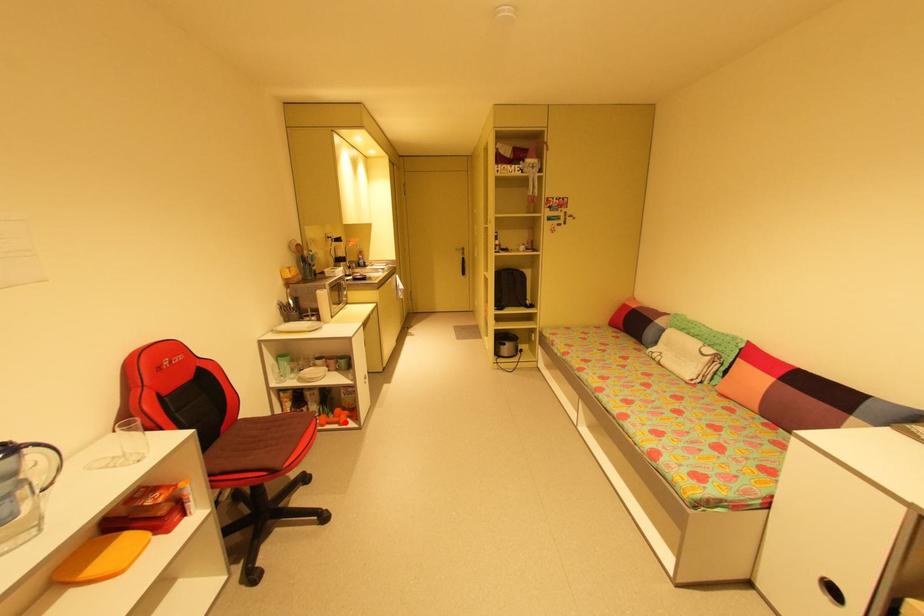
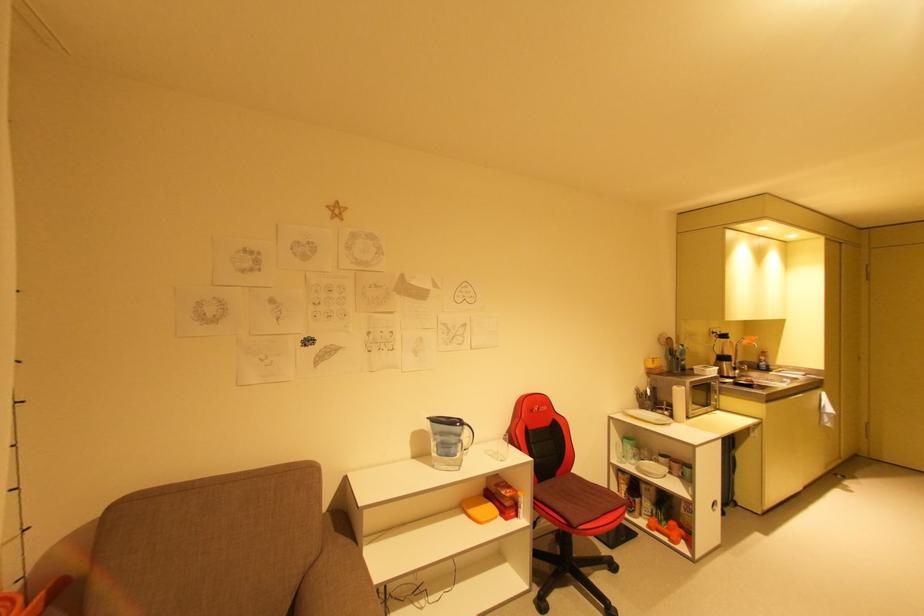
Question: I am providing you with two images of the same scene from different viewpoints. Given a red point in image1, look at the same physical point in image2. Is it:

Choices:
 (A) Closer to the viewpoint
 (B) Farther from the viewpoint

Answer: (B)